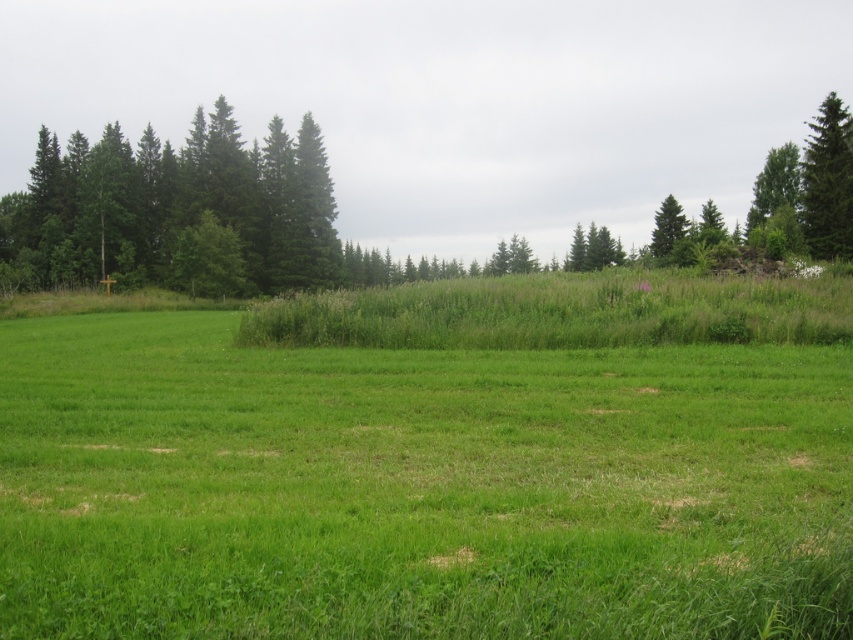
Can you confirm if green textured tree at right is thinner than green textured tree at upper right?

Yes.

Measure the distance between point (815,236) and camera.

A distance of 173.48 feet exists between point (815,236) and camera.

This screenshot has height=640, width=853. Identify the location of green textured tree at right. (828, 182).

Is green matte tree at left thinner than green matte tree at upper center?

No.

Can you confirm if green matte tree at left is bigger than green matte tree at upper center?

No.

In order to click on green matte tree at left in this screenshot , I will do `click(175, 204)`.

Is point (50, 172) closer to camera compared to point (827, 257)?

No, it is behind (827, 257).

Between green matte tree at left and green textured tree at right, which one has less height?

With less height is green textured tree at right.

I want to click on green matte tree at left, so click(175, 204).

Find the location of a particular element. This screenshot has width=853, height=640. green matte tree at left is located at coordinates (175, 204).